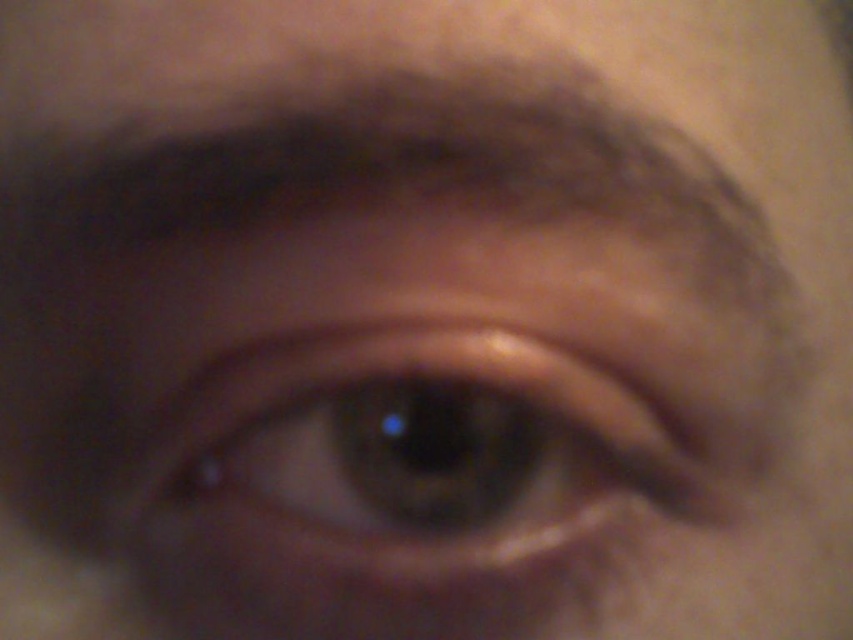
You are a makeup artist preparing to apply eyeliner. You have a small brush that can only cover an area up to the width of the dark brown hair at upper center. Can you use this brush to cover the entire brown matte eye at center without needing a larger tool?

The brown matte eye at center has a lesser width compared to dark brown hair at upper center, so yes, the small brush designed for the dark brown hair at upper center can adequately cover the entire brown matte eye at center since it is narrower.

You are an AI analyzing facial features. You need to locate the brown matte eye at center in an image. What are its coordinates?

The coordinates of the brown matte eye at center are at point (413, 452).

You are a makeup artist preparing to apply eyeliner to the brown matte eye at center and the dark brown hair at upper center. Which object is located to the right of the other?

The brown matte eye at center is positioned on the right side of dark brown hair at upper center, so the brown matte eye at center is to the right of the dark brown hair at upper center.